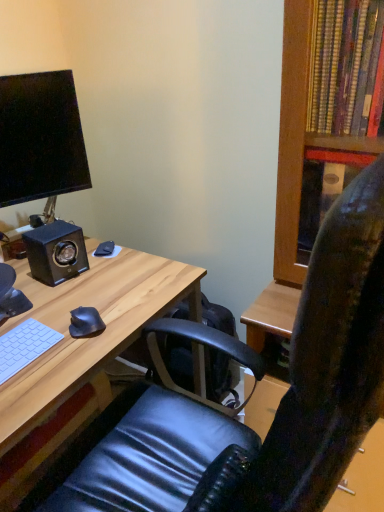
Where is `free space in front of black matte mouse at lower left, marked as the 1th mouse in a front-to-back arrangement`? This screenshot has height=512, width=384. free space in front of black matte mouse at lower left, marked as the 1th mouse in a front-to-back arrangement is located at coordinates (62, 366).